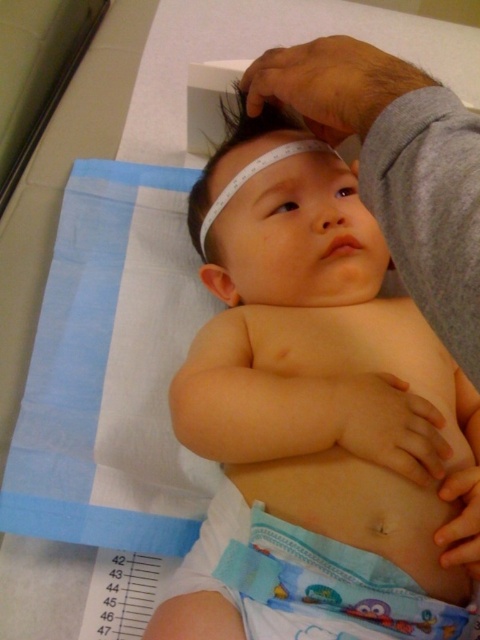
From the picture: You are a nurse preparing to measure the baby. The white smooth baby at center is on a cloth, and the blue printed diaper at center is underneath. Which object takes up more space in the image?

The white smooth baby at center is larger in size than the blue printed diaper at center, so the baby takes up more space in the image.

You are a nurse preparing to measure the baby. The measuring tape is around the baby. To ensure accuracy, you need to know which object is taller. Which is taller between the white smooth baby at center and the blue printed diaper at center?

The white smooth baby at center has a greater height compared to the blue printed diaper at center, so the white smooth baby at center is taller.